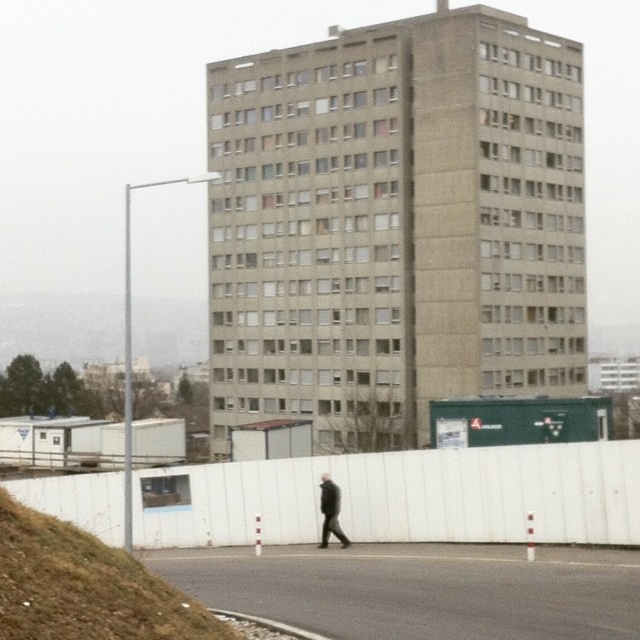
Is gray concrete building at center in front of dark gray coat at center?

No.

Looking at this image, which is more to the left, gray concrete building at center or dark gray coat at center?

gray concrete building at center

Is point (544, 152) positioned before point (339, 504)?

No, (544, 152) is further to viewer.

At what (x,y) coordinates should I click in order to perform the action: click on gray concrete building at center. Please return your answer as a coordinate pair (x, y). The height and width of the screenshot is (640, 640). Looking at the image, I should click on (394, 225).

Is point (17, 518) less distant than point (326, 477)?

Yes.

Which is behind, point (29, 576) or point (326, 520)?

Point (326, 520)

Where is `green grass at lower left`? green grass at lower left is located at coordinates (84, 586).

Locate an element on the screen. This screenshot has width=640, height=640. green grass at lower left is located at coordinates (84, 586).

Does gray concrete building at center appear on the left side of green grass at lower left?

Indeed, gray concrete building at center is positioned on the left side of green grass at lower left.

Can you confirm if gray concrete building at center is positioned below green grass at lower left?

No, gray concrete building at center is not below green grass at lower left.

What do you see at coordinates (394, 225) in the screenshot? Image resolution: width=640 pixels, height=640 pixels. I see `gray concrete building at center` at bounding box center [394, 225].

This screenshot has width=640, height=640. I want to click on gray concrete building at center, so click(x=394, y=225).